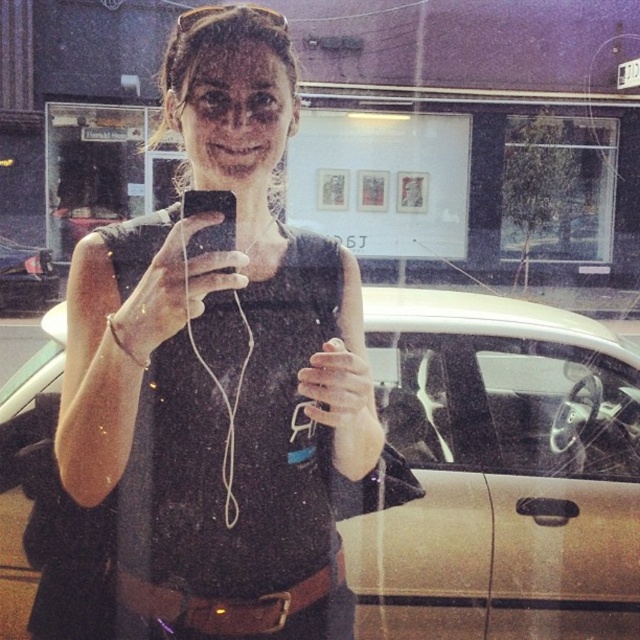
You are a photographer trying to determine the best angle for a portrait. You notice two points in the image at coordinates point (202, 420) and point (618, 394). Which point is closer to the camera?

Point (202, 420) is closer to the camera than point (618, 394).

You are a fashion designer analyzing clothing sizes in the image. The black matte tank top at center and transparent glass steering wheel at center are both visible. Which object is bigger in size?

The black matte tank top at center is larger in size than the transparent glass steering wheel at center.

What is the exact position of the black matte tank top at center in the image?

The black matte tank top at center is located at point coordinates of (220,371).